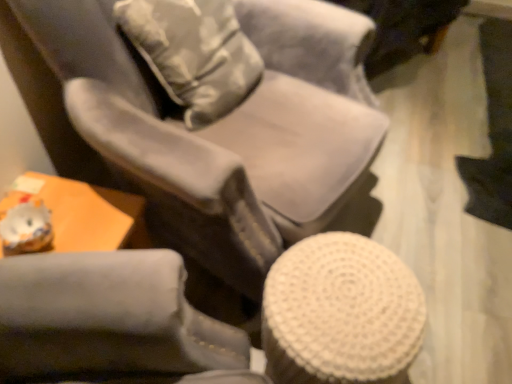
Where is `vacant space situated above white woven stool at lower right (from a real-world perspective)`? The image size is (512, 384). vacant space situated above white woven stool at lower right (from a real-world perspective) is located at coordinates (345, 298).